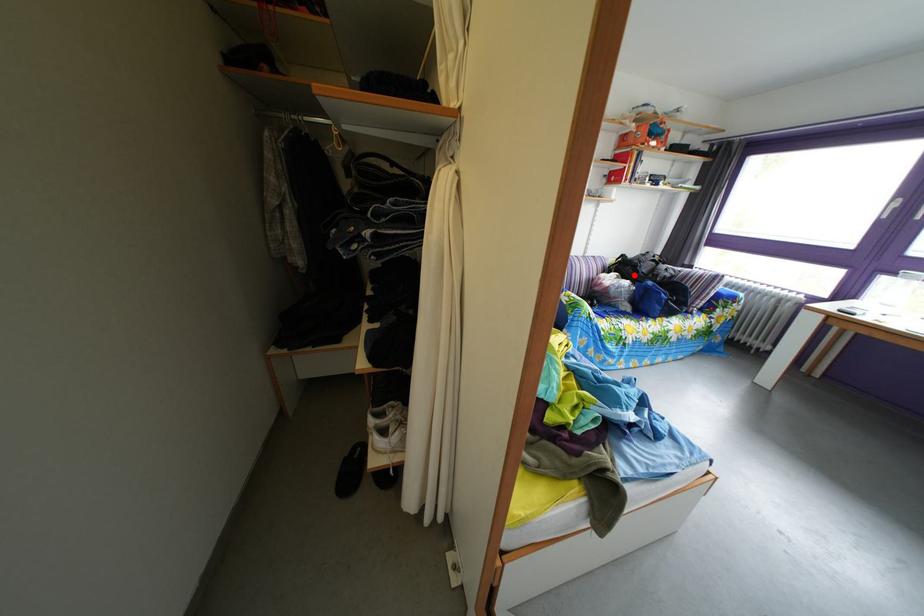
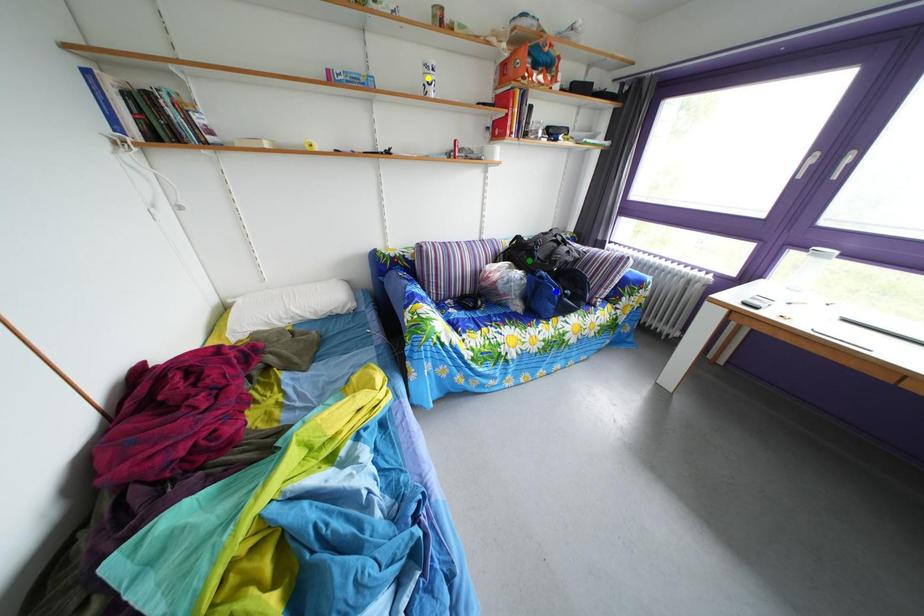
Question: I am providing you with two images of the same scene from different viewpoints. A red point is marked on the first image. You are given multiple points on the second image. Which spot in image 2 lines up with the point in image 1?

Choices:
 (A) yellow point
 (B) green point
 (C) blue point

Answer: (B)